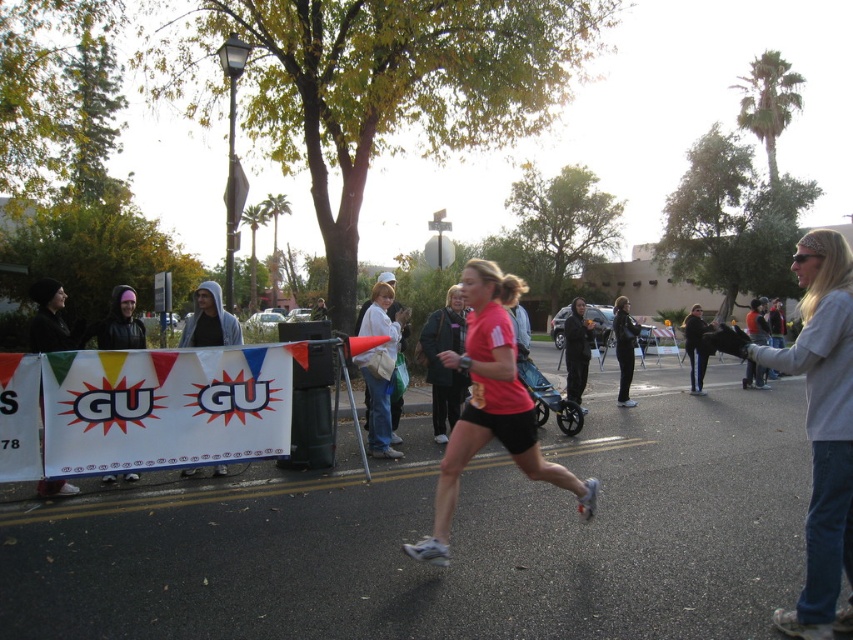
Question: Which point is closer to the camera?

Choices:
 (A) (630, 372)
 (B) (360, 324)

Answer: (B)

Question: Does gray cotton sweatshirt at right appear on the left side of black leather jacket at center?

Choices:
 (A) no
 (B) yes

Answer: (B)

Question: Where is gray cotton sweatshirt at right located in relation to pink matte running shirt at center in the image?

Choices:
 (A) below
 (B) above

Answer: (B)

Question: Which point is farther from the camera taking this photo?

Choices:
 (A) (619, 381)
 (B) (195, 467)

Answer: (A)

Question: Is gray cotton sweatshirt at right smaller than pink matte running shirt at center?

Choices:
 (A) yes
 (B) no

Answer: (A)

Question: Which object is closer to the camera taking this photo?

Choices:
 (A) gray hoodie at center
 (B) white cotton shirt at center

Answer: (A)